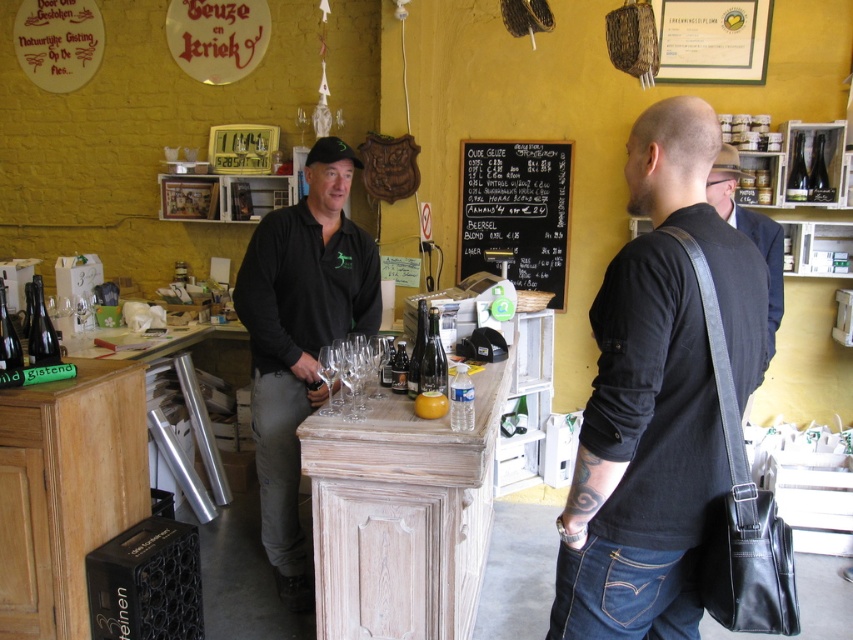
Does clear glass wine glass at center have a greater height compared to translucent glass bottle at center?

Correct, clear glass wine glass at center is much taller as translucent glass bottle at center.

Does point (331, 388) come in front of point (407, 368)?

Yes, point (331, 388) is in front of point (407, 368).

Where is `clear glass wine glass at center`? This screenshot has height=640, width=853. clear glass wine glass at center is located at coordinates (328, 378).

You are a GUI agent. You are given a task and a screenshot of the screen. Output one action in this format:
    pyautogui.click(x=<x>, y=<y>)
    Task: Click on the clear glass wine glass at center
    This screenshot has height=640, width=853.
    Given the screenshot: What is the action you would take?
    pyautogui.click(x=328, y=378)

Which of these two, matte black bottle at left or matte black bottle at center, stands shorter?

matte black bottle at left

Who is more distant from viewer, (33, 337) or (824, 179)?

The point (824, 179) is behind.

Who is more forward, (x=33, y=323) or (x=822, y=138)?

Point (x=33, y=323)

Find the location of a particular element. This screenshot has height=640, width=853. matte black bottle at left is located at coordinates (41, 330).

Does black leather bag at right appear on the left side of matte black bottle at left?

No, black leather bag at right is not to the left of matte black bottle at left.

Is point (613, 355) farther from camera compared to point (27, 352)?

No.

You are a GUI agent. You are given a task and a screenshot of the screen. Output one action in this format:
    pyautogui.click(x=<x>, y=<y>)
    Task: Click on the black leather bag at right
    This screenshot has width=853, height=640.
    Given the screenshot: What is the action you would take?
    pyautogui.click(x=657, y=396)